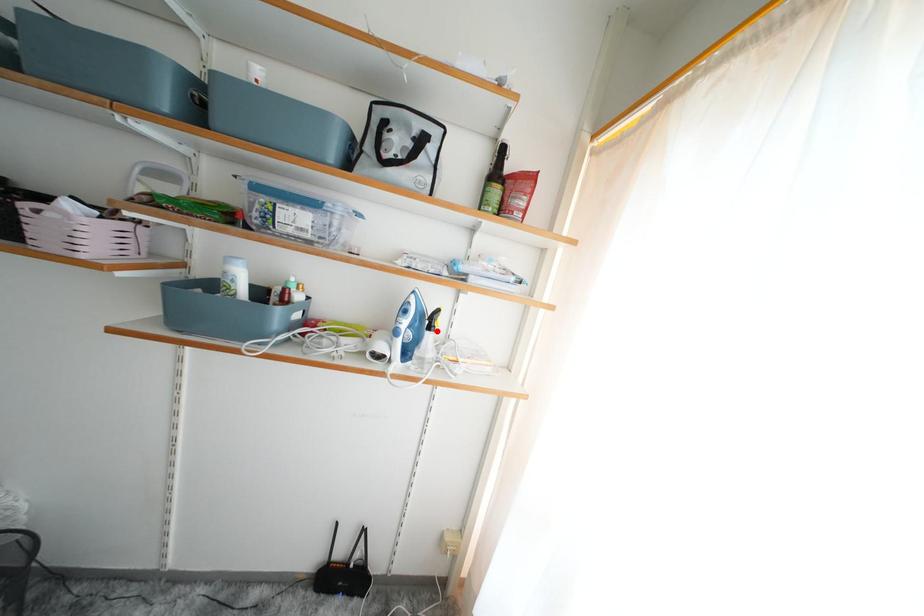
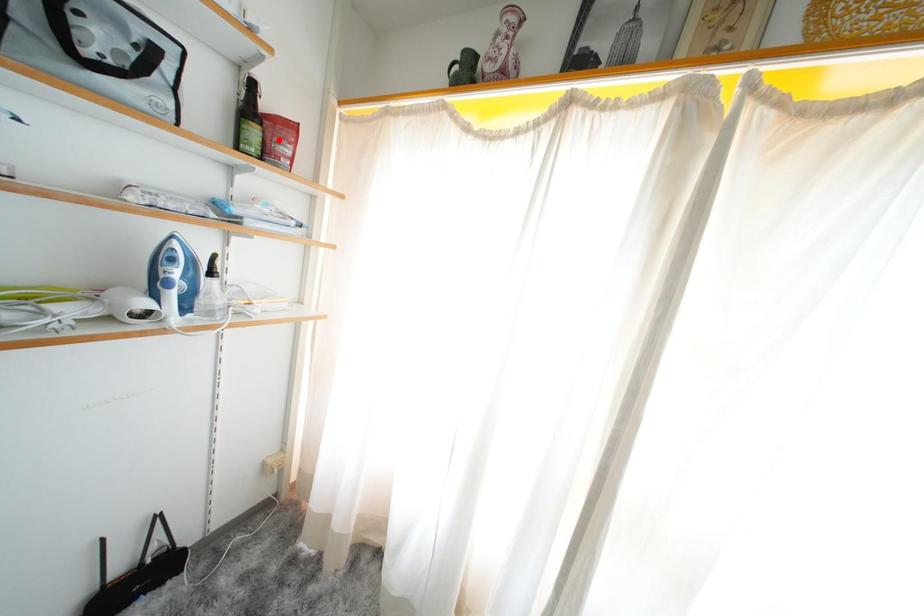
I am providing you with two images of the same scene from different viewpoints. A red point is marked on the first image and another point is marked on the second image. Is the red point in image1 aligned with the point shown in image2?

No